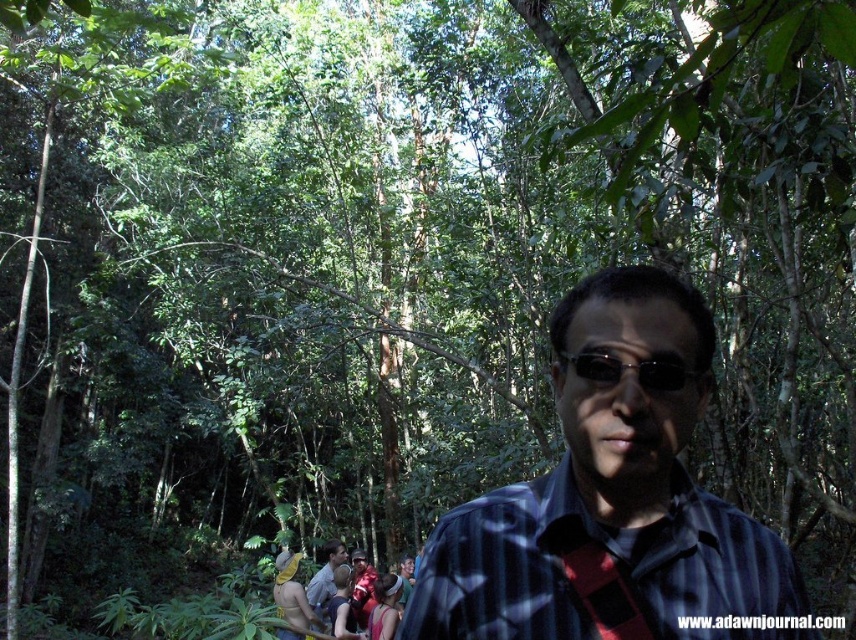
You are an observer in the forest scene. You notice the black plastic sunglasses at center and the matte blue shirt at lower center. Which object takes up more space in the image?

The matte blue shirt at lower center takes up more space in the image because the black plastic sunglasses at center has a smaller size compared to it.

You are standing in the forest and see a man with sunglasses and a dark shirt. There is also a point marked at coordinates (611, 506). What object is located at that point?

The point at (611, 506) corresponds to the blue striped shirt at center.

You are a hiker in a dense forest. You see a blue striped shirt at center and a matte blue shirt at lower center. Which shirt is taller?

The blue striped shirt at center is taller than the matte blue shirt at lower center.